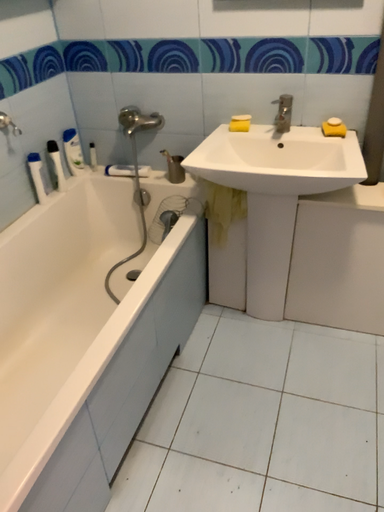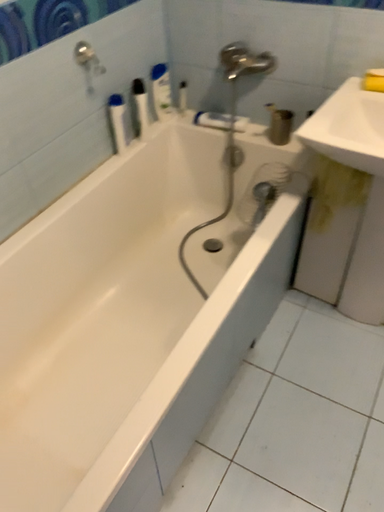
Question: How did the camera likely rotate when shooting the video?

Choices:
 (A) rotated upward
 (B) rotated downward

Answer: (B)